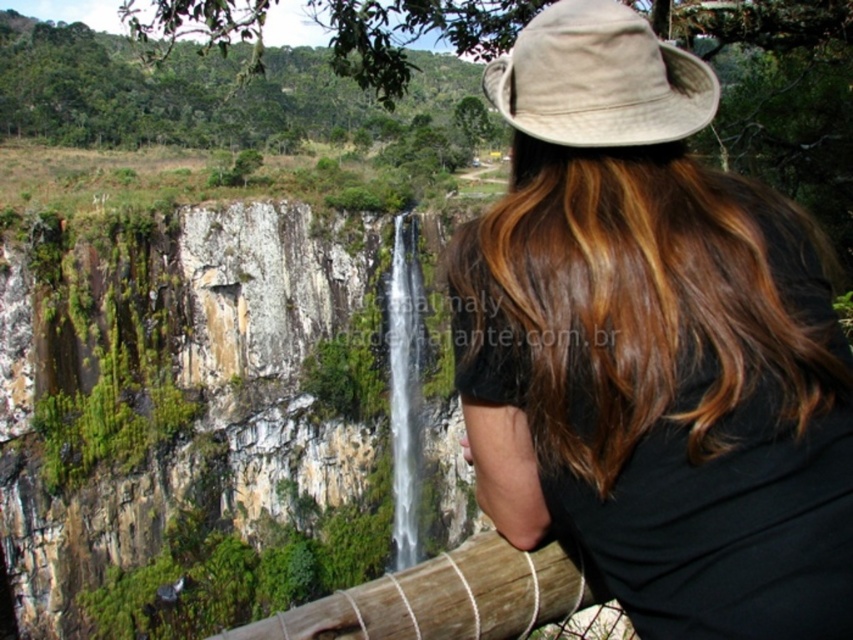
Does green mossy rock at center appear on the left side of brown wooden rail at lower center?

Indeed, green mossy rock at center is positioned on the left side of brown wooden rail at lower center.

How distant is green mossy rock at center from brown wooden rail at lower center?

The distance of green mossy rock at center from brown wooden rail at lower center is 55.07 meters.

Who is more distant from viewer, (219, 380) or (451, 618)?

The point (219, 380) is more distant.

Where is `green mossy rock at center`? The width and height of the screenshot is (853, 640). green mossy rock at center is located at coordinates click(175, 394).

Who is lower down, brown hair at center or white smooth waterfall at center?

white smooth waterfall at center is lower down.

Who is more forward, (527,468) or (392,392)?

Point (527,468)

You are a GUI agent. You are given a task and a screenshot of the screen. Output one action in this format:
    pyautogui.click(x=<x>, y=<y>)
    Task: Click on the brown hair at center
    
    Given the screenshot: What is the action you would take?
    click(653, 346)

Between point (54, 419) and point (415, 516), which one is positioned behind?

Point (415, 516)

Is green mossy rock at center bigger than white smooth waterfall at center?

Correct, green mossy rock at center is larger in size than white smooth waterfall at center.

Where is `green mossy rock at center`? The width and height of the screenshot is (853, 640). green mossy rock at center is located at coordinates (175, 394).